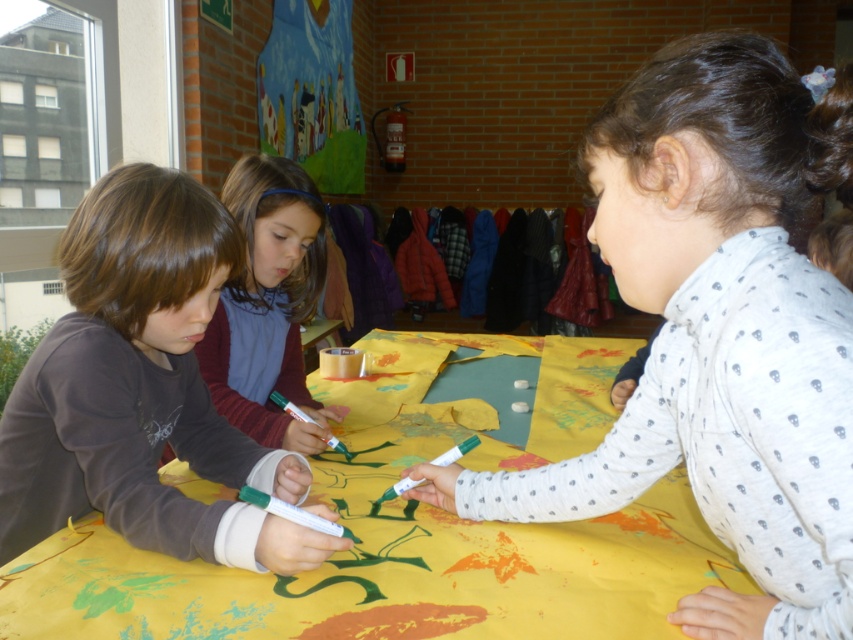
Question: Among these points, which one is farthest from the camera?

Choices:
 (A) (326, 580)
 (B) (146, 529)

Answer: (B)

Question: From the image, what is the correct spatial relationship of white dotted shirt at upper right in relation to yellow paper at center?

Choices:
 (A) right
 (B) left

Answer: (A)

Question: Which of the following is the farthest from the observer?

Choices:
 (A) (380, 394)
 (B) (233, 358)
 (C) (527, 500)

Answer: (A)

Question: Can you confirm if dark brown hair at left is wider than matte brown shirt at center?

Choices:
 (A) yes
 (B) no

Answer: (A)

Question: Which object is farther from the camera taking this photo?

Choices:
 (A) matte brown shirt at center
 (B) white dotted shirt at upper right
 (C) dark brown hair at left

Answer: (A)

Question: Where is white dotted shirt at upper right located in relation to yellow paper at center in the image?

Choices:
 (A) below
 (B) above

Answer: (B)